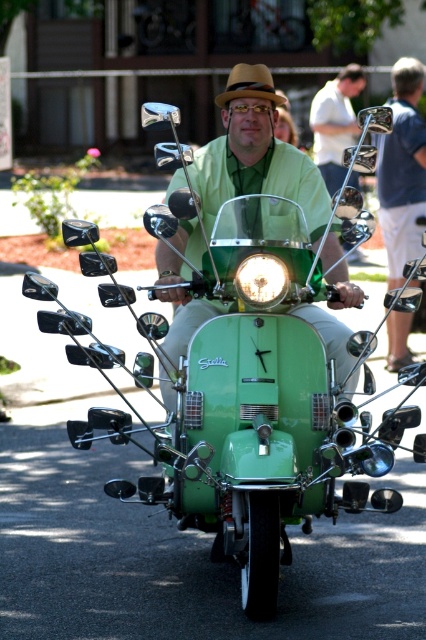
Question: Is matte green scooter at center to the right of matte green headlight at center from the viewer's perspective?

Choices:
 (A) yes
 (B) no

Answer: (A)

Question: Where is matte green headlight at center located in relation to brown felt fedora at center in the image?

Choices:
 (A) left
 (B) right

Answer: (A)

Question: Which point is closer to the camera?

Choices:
 (A) green matte scooter at center
 (B) light blue denim shorts at center

Answer: (A)

Question: Does matte green scooter at center have a smaller size compared to brown felt fedora at center?

Choices:
 (A) no
 (B) yes

Answer: (A)

Question: Among these objects, which one is nearest to the camera?

Choices:
 (A) matte green headlight at center
 (B) light blue denim shorts at center
 (C) matte green scooter at center

Answer: (A)

Question: Which of the following is the closest to the observer?

Choices:
 (A) (348, 332)
 (B) (334, 148)
 (C) (414, 145)

Answer: (A)